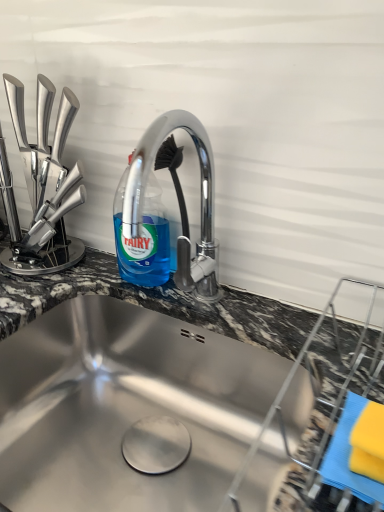
Question: Is blue translucent liquid at upper center at the right side of stainless steel sink at center?

Choices:
 (A) yes
 (B) no

Answer: (B)

Question: Is blue translucent liquid at upper center to the left of stainless steel sink at center from the viewer's perspective?

Choices:
 (A) no
 (B) yes

Answer: (B)

Question: Are blue translucent liquid at upper center and stainless steel sink at center located far from each other?

Choices:
 (A) no
 (B) yes

Answer: (A)

Question: Is blue translucent liquid at upper center outside stainless steel sink at center?

Choices:
 (A) no
 (B) yes

Answer: (B)

Question: Can you confirm if blue translucent liquid at upper center is taller than stainless steel sink at center?

Choices:
 (A) no
 (B) yes

Answer: (B)

Question: From the image's perspective, is blue translucent liquid at upper center on stainless steel sink at center?

Choices:
 (A) no
 (B) yes

Answer: (B)

Question: From the image's perspective, is stainless steel sink at center over blue translucent liquid at upper center?

Choices:
 (A) yes
 (B) no

Answer: (B)

Question: From a real-world perspective, is stainless steel sink at center located beneath blue translucent liquid at upper center?

Choices:
 (A) yes
 (B) no

Answer: (A)

Question: Is stainless steel sink at center next to blue translucent liquid at upper center?

Choices:
 (A) yes
 (B) no

Answer: (B)

Question: Does stainless steel sink at center have a greater height compared to blue translucent liquid at upper center?

Choices:
 (A) yes
 (B) no

Answer: (B)

Question: Is stainless steel sink at center positioned with its back to blue translucent liquid at upper center?

Choices:
 (A) no
 (B) yes

Answer: (A)

Question: Is blue translucent liquid at upper center inside stainless steel sink at center?

Choices:
 (A) no
 (B) yes

Answer: (A)

Question: Is blue translucent liquid at upper center in front of or behind stainless steel sink at center in the image?

Choices:
 (A) behind
 (B) front

Answer: (A)